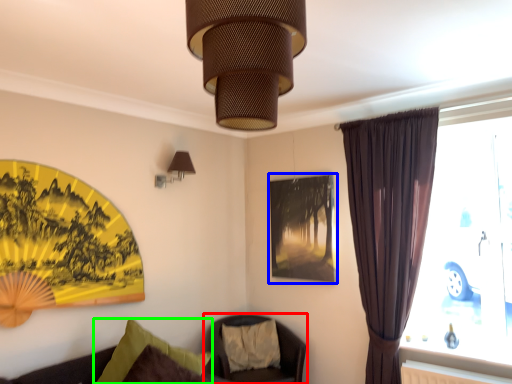
Question: Based on their relative distances, which object is farther from chair (highlighted by a red box)? Choose from picture frame (highlighted by a blue box) and pillow (highlighted by a green box).

Choices:
 (A) picture frame
 (B) pillow

Answer: (B)